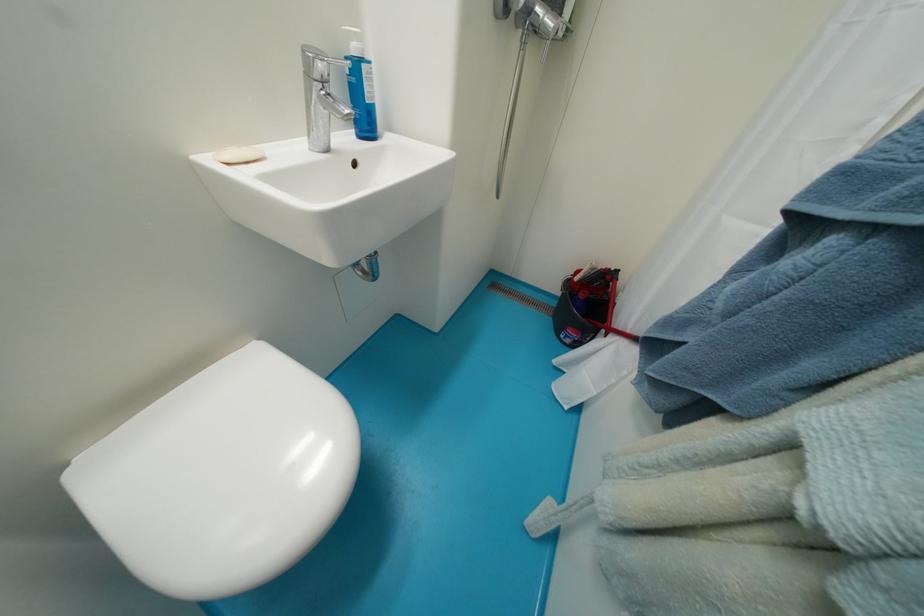
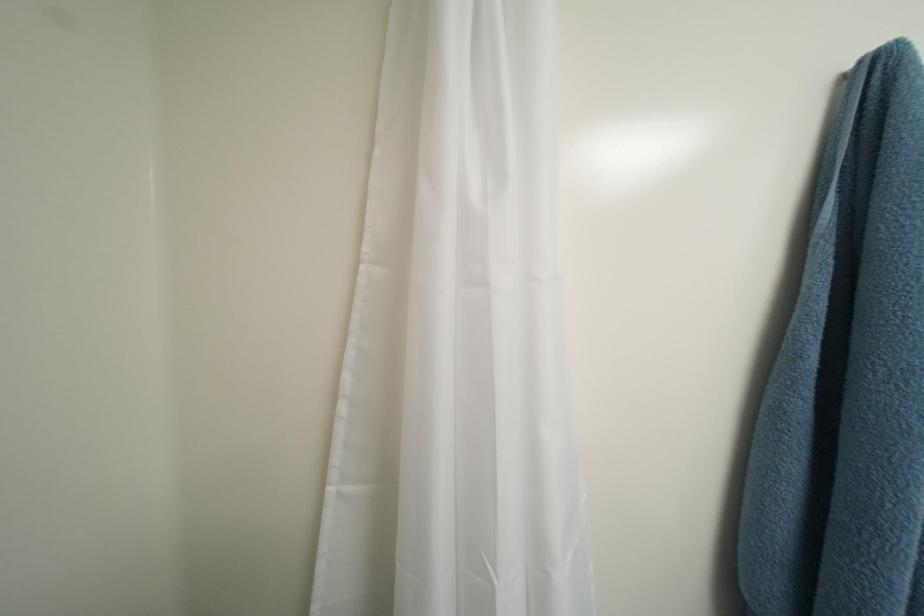
The images are taken continuously from a first-person perspective. In which direction is your viewpoint rotating?

The camera rotated toward right-down.